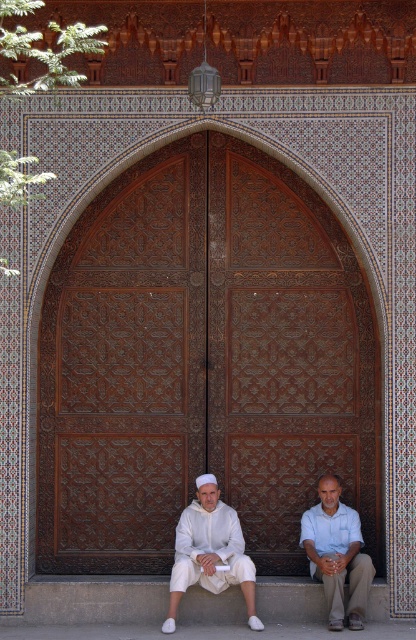
Question: Is the position of white matte clothing at lower center less distant than that of white cotton shirt at lower center?

Choices:
 (A) no
 (B) yes

Answer: (A)

Question: Does brown carved wood door at center lie behind white cotton shirt at lower center?

Choices:
 (A) no
 (B) yes

Answer: (B)

Question: Which object is closer to the camera taking this photo?

Choices:
 (A) white matte clothing at lower center
 (B) brown carved wood door at center
 (C) white cotton clothing at center

Answer: (A)

Question: Which object appears closest to the camera in this image?

Choices:
 (A) white cotton shirt at lower center
 (B) brown carved wood door at center

Answer: (A)

Question: Which of the following is the closest to the observer?

Choices:
 (A) (192, 568)
 (B) (84, 512)
 (C) (316, 531)

Answer: (A)

Question: Is brown carved wood door at center below white cotton shirt at lower center?

Choices:
 (A) no
 (B) yes

Answer: (A)